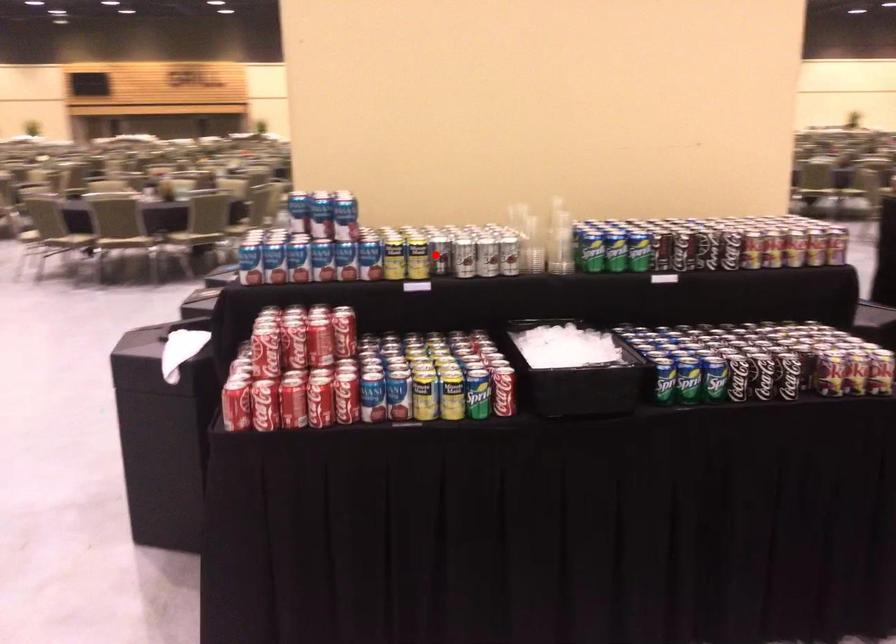
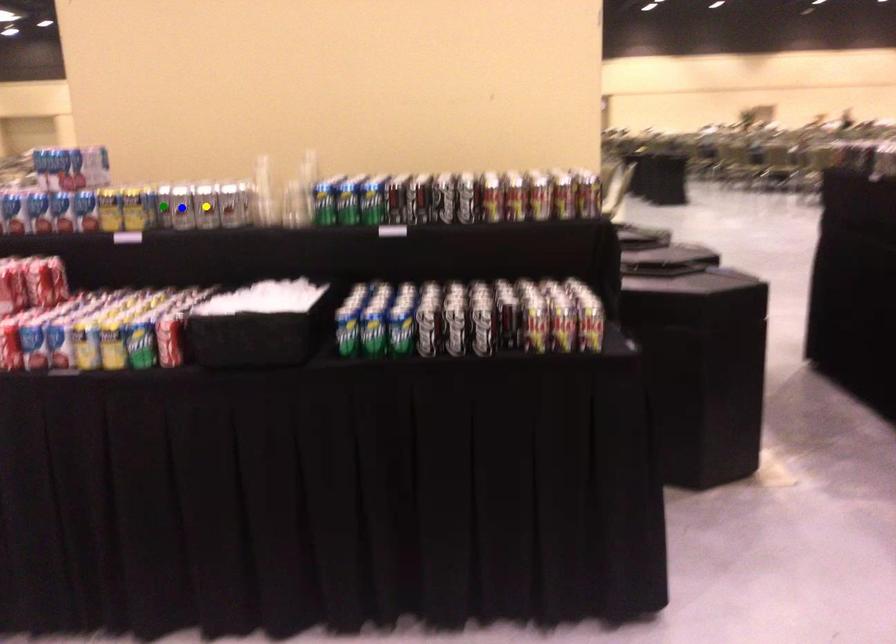
Question: I am providing you with two images of the same scene from different viewpoints. A red point is marked on the first image. You are given multiple points on the second image. Which mark in image 2 goes with the point in image 1?

Choices:
 (A) green point
 (B) yellow point
 (C) blue point

Answer: (A)